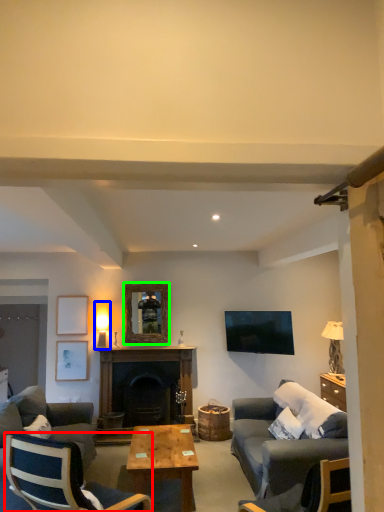
Question: Considering the real-world distances, which object is closest to chair (highlighted by a red box)? lamp (highlighted by a blue box) or picture frame (highlighted by a green box).

Choices:
 (A) lamp
 (B) picture frame

Answer: (B)